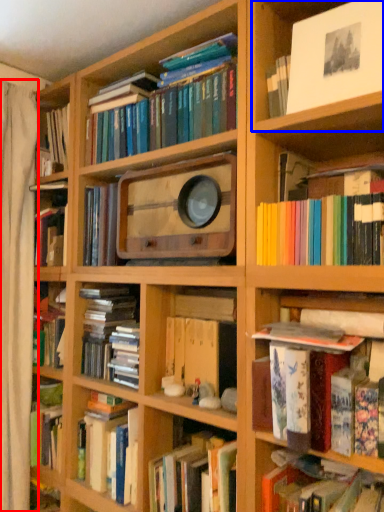
Question: Among these objects, which one is farthest to the camera, curtain (highlighted by a red box) or cabinet (highlighted by a blue box)?

Choices:
 (A) curtain
 (B) cabinet

Answer: (A)